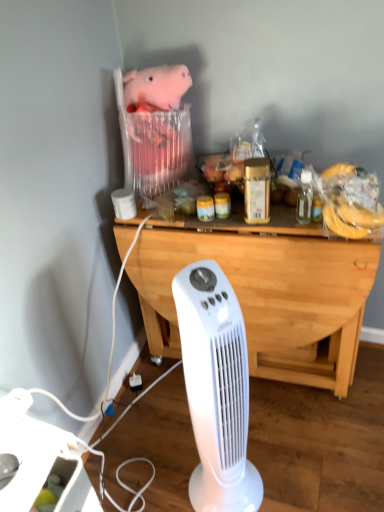
At what (x,y) coordinates should I click in order to perform the action: click on vacant area situated to the left side of clear glass bottle at upper right. Please return your answer as a coordinate pair (x, y). Looking at the image, I should click on (271, 222).